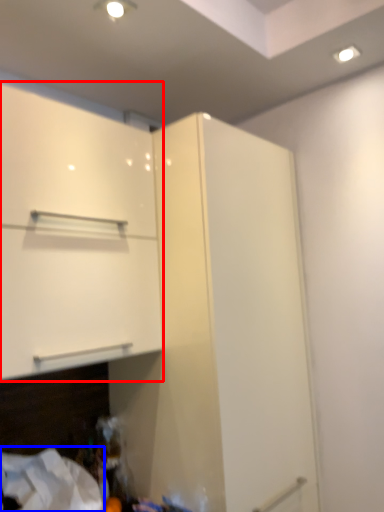
Question: Which point is further to the camera, cabinetry (highlighted by a red box) or sheet (highlighted by a blue box)?

Choices:
 (A) cabinetry
 (B) sheet

Answer: (B)